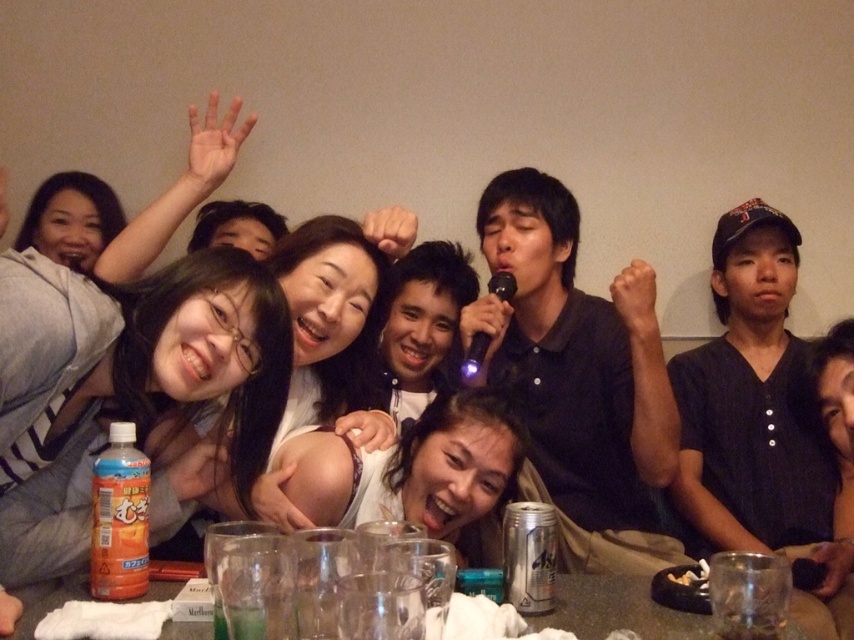
Does white matte shirt at center have a lesser width compared to clear glass table at lower center?

In fact, white matte shirt at center might be wider than clear glass table at lower center.

How much distance is there between white matte shirt at center and clear glass table at lower center?

white matte shirt at center and clear glass table at lower center are 25.63 inches apart from each other.

Where is `white matte shirt at center`? This screenshot has width=854, height=640. white matte shirt at center is located at coordinates (338, 317).

The width and height of the screenshot is (854, 640). I want to click on white matte shirt at center, so click(x=338, y=317).

Who is positioned more to the left, black matte microphone at center or white matte shirt at center?

white matte shirt at center is more to the left.

Is black matte microphone at center positioned at the back of white matte shirt at center?

A: Yes, it is behind white matte shirt at center.

Is point (572, 248) less distant than point (297, 262)?

No.

Locate an element on the screen. The height and width of the screenshot is (640, 854). black matte microphone at center is located at coordinates (574, 356).

Between point (249, 349) and point (355, 433), which one is positioned behind?

Positioned behind is point (355, 433).

Does point (153, 355) come farther from viewer compared to point (285, 422)?

No.

At what (x,y) coordinates should I click in order to perform the action: click on matte black hair at center. Please return your answer as a coordinate pair (x, y). The height and width of the screenshot is (640, 854). Looking at the image, I should click on (123, 378).